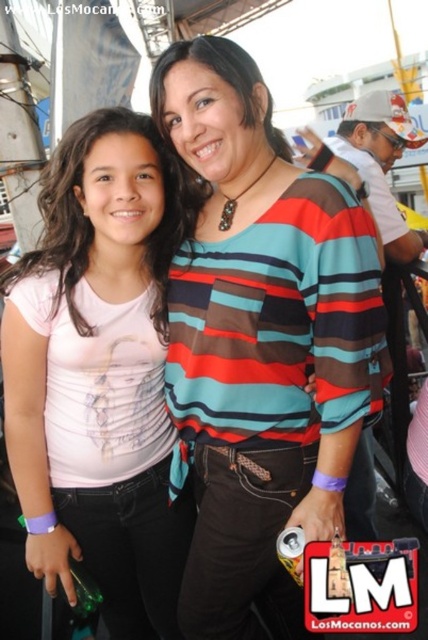
Is the position of striped cotton shirt at center more distant than that of pink matte shirt at center?

No, striped cotton shirt at center is closer to the viewer.

I want to click on striped cotton shirt at center, so click(261, 340).

Which is behind, point (208, 349) or point (121, 129)?

Positioned behind is point (208, 349).

I want to click on striped cotton shirt at center, so [x=261, y=340].